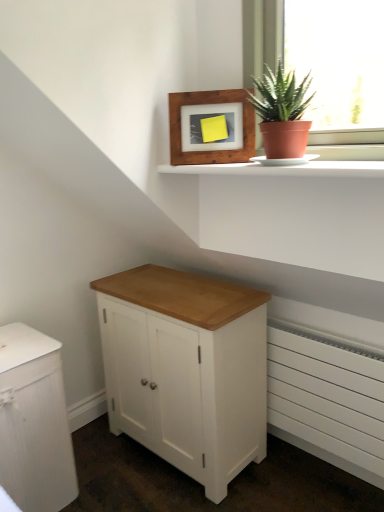
Question: Can you confirm if white wood cabinet at center, which is the 2th chest of drawers from left to right, is taller than wooden frame at upper center?

Choices:
 (A) no
 (B) yes

Answer: (B)

Question: From the image's perspective, is white wood cabinet at center, acting as the first chest of drawers starting from the right, beneath wooden frame at upper center?

Choices:
 (A) yes
 (B) no

Answer: (A)

Question: Can you confirm if white wood cabinet at center, which is the 2th chest of drawers from left to right, is wider than wooden frame at upper center?

Choices:
 (A) yes
 (B) no

Answer: (A)

Question: Is wooden frame at upper center a part of white wood cabinet at center, which is the 2th chest of drawers from left to right?

Choices:
 (A) no
 (B) yes

Answer: (A)

Question: Is white wood cabinet at center, which is the 2th chest of drawers from left to right, in contact with wooden frame at upper center?

Choices:
 (A) no
 (B) yes

Answer: (A)

Question: Considering the relative sizes of white wood cabinet at center, which is the 2th chest of drawers from left to right, and wooden frame at upper center in the image provided, is white wood cabinet at center, which is the 2th chest of drawers from left to right, smaller than wooden frame at upper center?

Choices:
 (A) no
 (B) yes

Answer: (A)

Question: Does white wood cabinet at lower left, the 1th chest of drawers from the left, come behind white matte radiator at lower right?

Choices:
 (A) yes
 (B) no

Answer: (B)

Question: From a real-world perspective, is white wood cabinet at lower left, the 1th chest of drawers from the left, beneath white matte radiator at lower right?

Choices:
 (A) yes
 (B) no

Answer: (B)

Question: Is white wood cabinet at lower left, which is the second chest of drawers from right to left, facing towards white matte radiator at lower right?

Choices:
 (A) yes
 (B) no

Answer: (B)

Question: Is white wood cabinet at lower left, which is the second chest of drawers from right to left, positioned with its back to white matte radiator at lower right?

Choices:
 (A) no
 (B) yes

Answer: (A)

Question: Considering the relative sizes of white wood cabinet at lower left, the 1th chest of drawers from the left, and white matte radiator at lower right in the image provided, is white wood cabinet at lower left, the 1th chest of drawers from the left, bigger than white matte radiator at lower right?

Choices:
 (A) no
 (B) yes

Answer: (B)

Question: Is white wood cabinet at lower left, which is the second chest of drawers from right to left, wider than white matte radiator at lower right?

Choices:
 (A) yes
 (B) no

Answer: (A)

Question: From a real-world perspective, is white wood cabinet at center, which is the 2th chest of drawers from left to right, over white matte radiator at lower right?

Choices:
 (A) yes
 (B) no

Answer: (A)